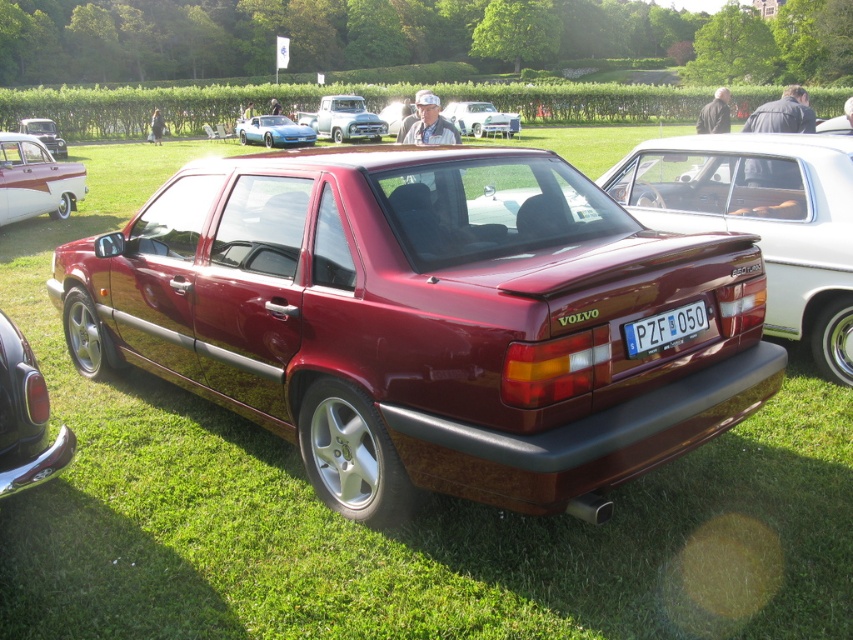
Question: In this image, where is glossy chrome bumper at lower left located relative to matte white car at left?

Choices:
 (A) left
 (B) right

Answer: (B)

Question: Estimate the real-world distances between objects in this image. Which object is farther from the satin burgundy car at center?

Choices:
 (A) shiny blue car at center
 (B) matte white car at left
 (C) metallic silver sedan at upper center

Answer: (C)

Question: Does glossy maroon sedan at center appear on the right side of glossy chrome bumper at lower left?

Choices:
 (A) yes
 (B) no

Answer: (A)

Question: Among these points, which one is farthest from the camera?

Choices:
 (A) (325, 99)
 (B) (611, 435)
 (C) (674, 314)

Answer: (A)

Question: Which of the following is the farthest from the observer?

Choices:
 (A) satin burgundy car at center
 (B) glossy maroon sedan at center
 (C) shiny silver car at upper left

Answer: (C)

Question: Is metallic silver truck at upper center below shiny blue car at center?

Choices:
 (A) yes
 (B) no

Answer: (B)